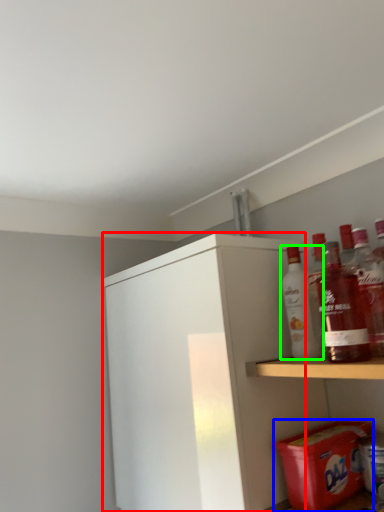
Question: Which object is positioned closest to cabinetry (highlighted by a red box)? Select from carton (highlighted by a blue box) and bottle (highlighted by a green box).

Choices:
 (A) carton
 (B) bottle

Answer: (B)